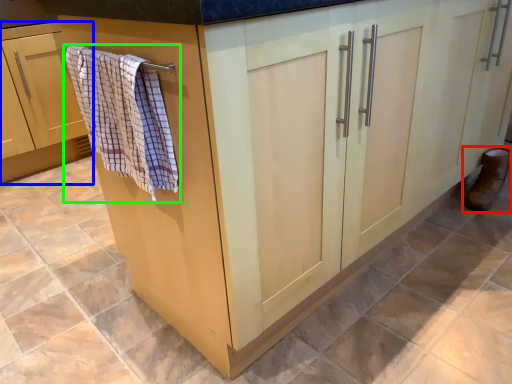
Question: Which is nearer to the footwear (highlighted by a red box)? cabinetry (highlighted by a blue box) or bath towel (highlighted by a green box).

Choices:
 (A) cabinetry
 (B) bath towel

Answer: (B)